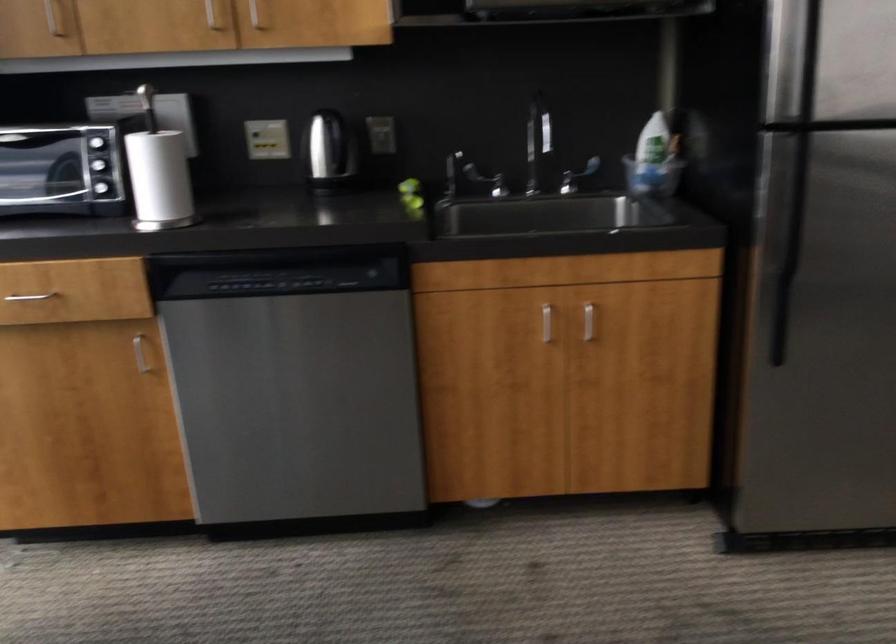
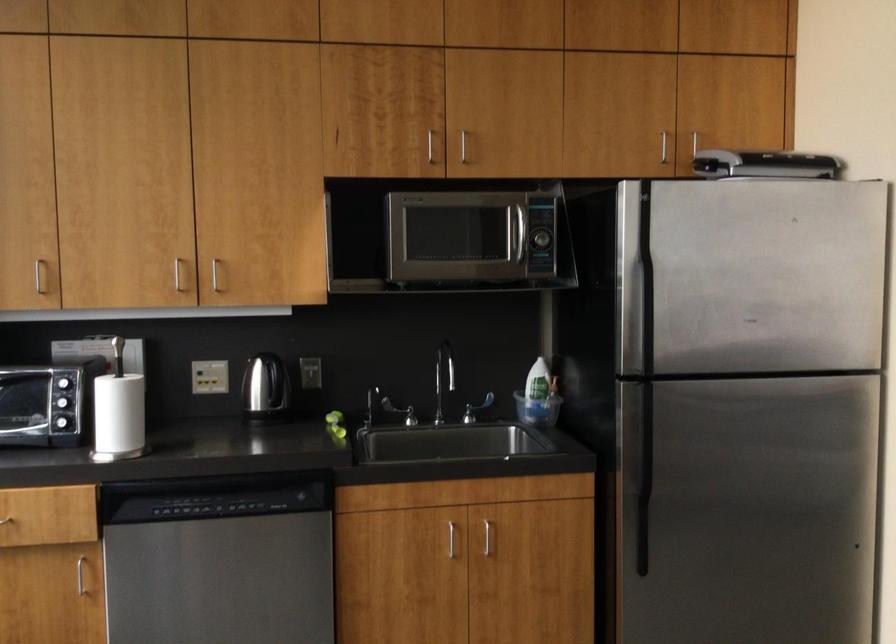
Question: Which direction would the cameraman need to move to produce the second image? Reply with the corresponding letter.

Choices:
 (A) Left
 (B) Right
 (C) Forward
 (D) Backward

Answer: (D)